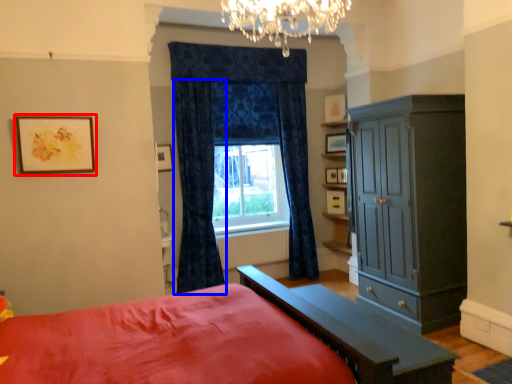
Question: Which of the following is the farthest to the observer, picture frame (highlighted by a red box) or curtain (highlighted by a blue box)?

Choices:
 (A) picture frame
 (B) curtain

Answer: (B)